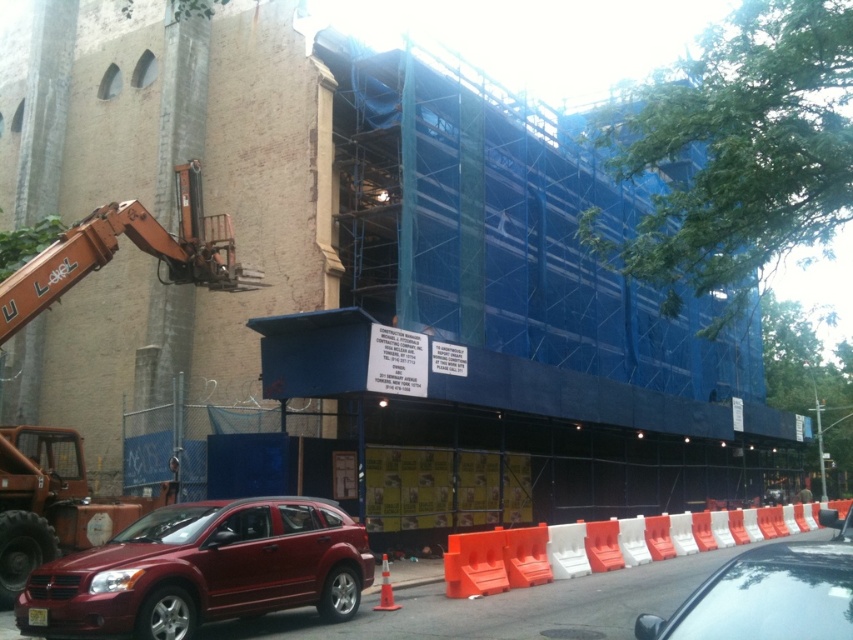
You are a delivery driver who needs to park your truck 25 feet away from the shiny red suv at lower left. Is the current parking spot available for your truck to meet this requirement?

The shiny red suv at lower left is 22.02 feet away from camera. Since the required distance is 25 feet, the current parking spot is not far enough. You need to find a spot further away.

You are a delivery driver who needs to park your truck near the shiny red suv at lower left. According to the coordinates provided, where exactly should you position your truck?

The shiny red suv at lower left is located at coordinates point (202, 570). You should position your truck near those coordinates to park nearby.